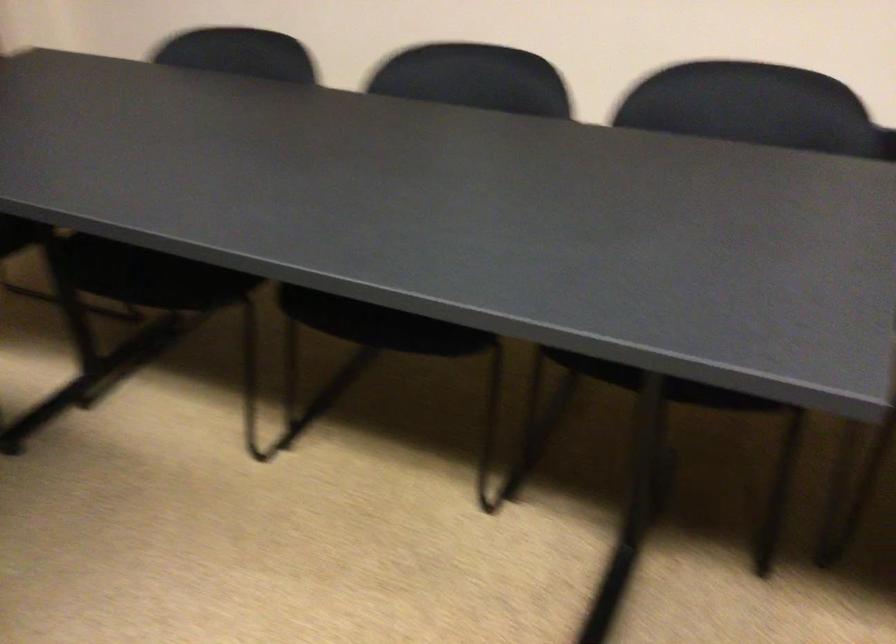
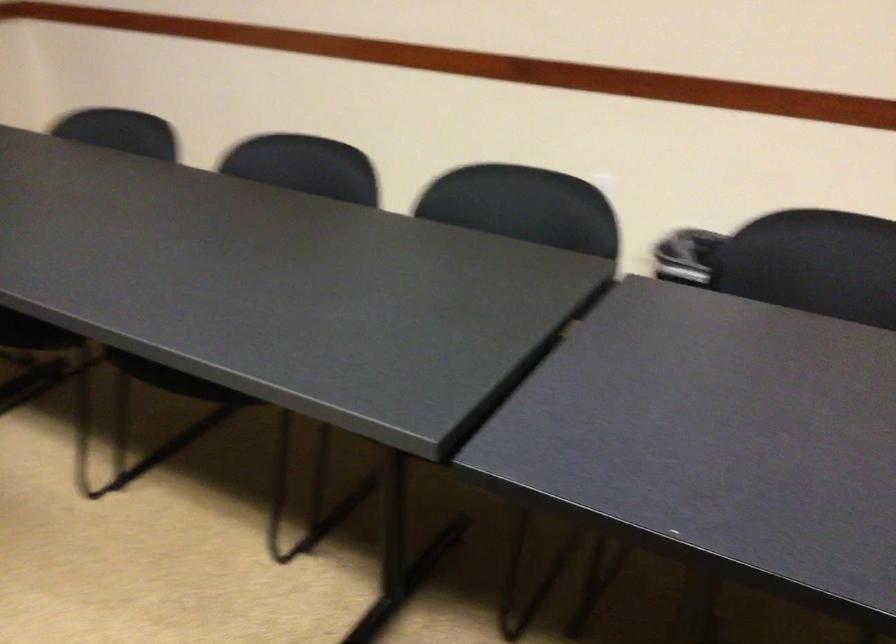
Question: Based on the continuous images, in which direction is the camera rotating? Reply with the corresponding letter.

Choices:
 (A) Left
 (B) Right
 (C) Up
 (D) Down

Answer: (C)